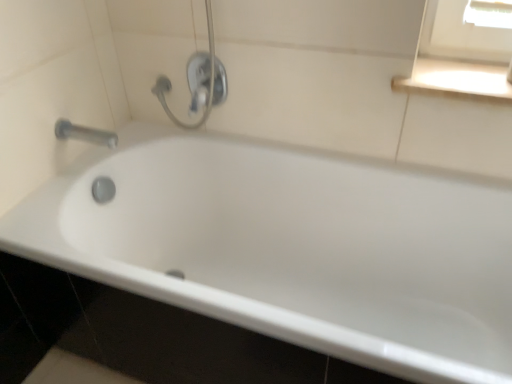
Question: Is satin nickel faucet at upper center smaller than silver metallic tap at upper left?

Choices:
 (A) yes
 (B) no

Answer: (B)

Question: Is satin nickel faucet at upper center wider than silver metallic tap at upper left?

Choices:
 (A) no
 (B) yes

Answer: (A)

Question: Considering the relative sizes of satin nickel faucet at upper center and silver metallic tap at upper left in the image provided, is satin nickel faucet at upper center shorter than silver metallic tap at upper left?

Choices:
 (A) no
 (B) yes

Answer: (A)

Question: From the image's perspective, is satin nickel faucet at upper center under silver metallic tap at upper left?

Choices:
 (A) no
 (B) yes

Answer: (A)

Question: Is satin nickel faucet at upper center touching silver metallic tap at upper left?

Choices:
 (A) no
 (B) yes

Answer: (A)

Question: Considering their positions, is satin nickel faucet at upper center located in front of or behind silver metallic tap at upper left?

Choices:
 (A) behind
 (B) front

Answer: (A)

Question: Is point (199, 59) positioned closer to the camera than point (58, 132)?

Choices:
 (A) farther
 (B) closer

Answer: (A)

Question: Visually, is satin nickel faucet at upper center positioned to the left or to the right of silver metallic tap at upper left?

Choices:
 (A) right
 (B) left

Answer: (A)

Question: From the image's perspective, is satin nickel faucet at upper center located above or below silver metallic tap at upper left?

Choices:
 (A) above
 (B) below

Answer: (A)

Question: Is white glossy window sill at upper right taller or shorter than satin nickel faucet at upper center?

Choices:
 (A) tall
 (B) short

Answer: (B)

Question: Would you say white glossy window sill at upper right is to the left or to the right of satin nickel faucet at upper center in the picture?

Choices:
 (A) right
 (B) left

Answer: (A)

Question: Looking at their shapes, would you say white glossy window sill at upper right is wider or thinner than satin nickel faucet at upper center?

Choices:
 (A) thin
 (B) wide

Answer: (B)

Question: Is white glossy window sill at upper right spatially inside satin nickel faucet at upper center, or outside of it?

Choices:
 (A) inside
 (B) outside

Answer: (B)

Question: Is white glossy bathtub at center in front of or behind satin nickel faucet at upper center in the image?

Choices:
 (A) front
 (B) behind

Answer: (A)

Question: Based on their sizes in the image, would you say white glossy bathtub at center is bigger or smaller than satin nickel faucet at upper center?

Choices:
 (A) small
 (B) big

Answer: (B)